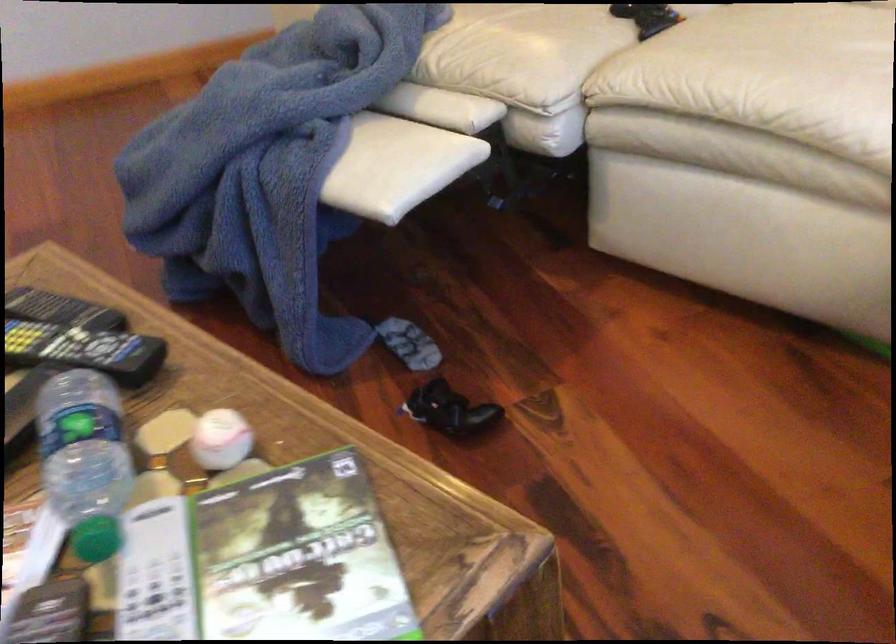
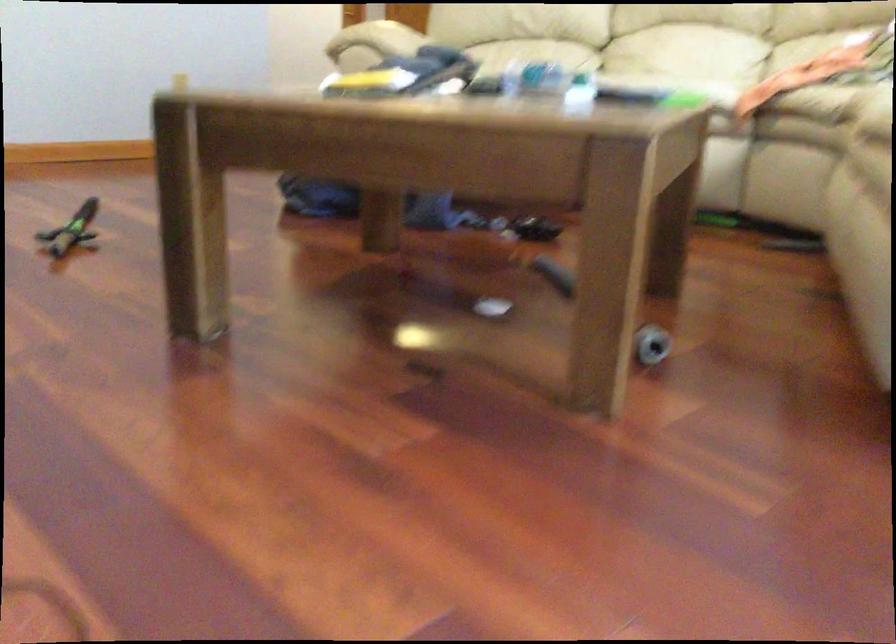
Question: I am providing you with two images of the same scene from different viewpoints. Please identify which objects are invisible in image2.

Choices:
 (A) white sofa sitting surface
 (B) sofa sitting surface
 (C) wooden chair sitting surface
 (D) grey cylindrical object

Answer: (A)